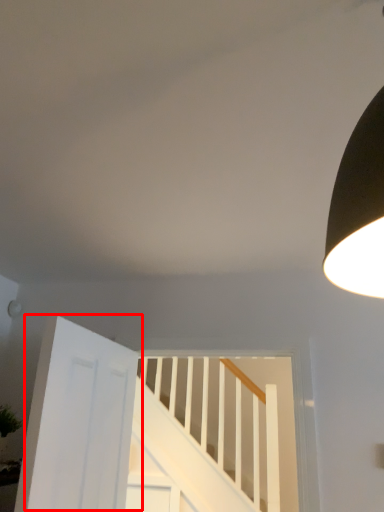
Question: In this image, where is door (annotated by the red box) located relative to stairs?

Choices:
 (A) right
 (B) left

Answer: (B)